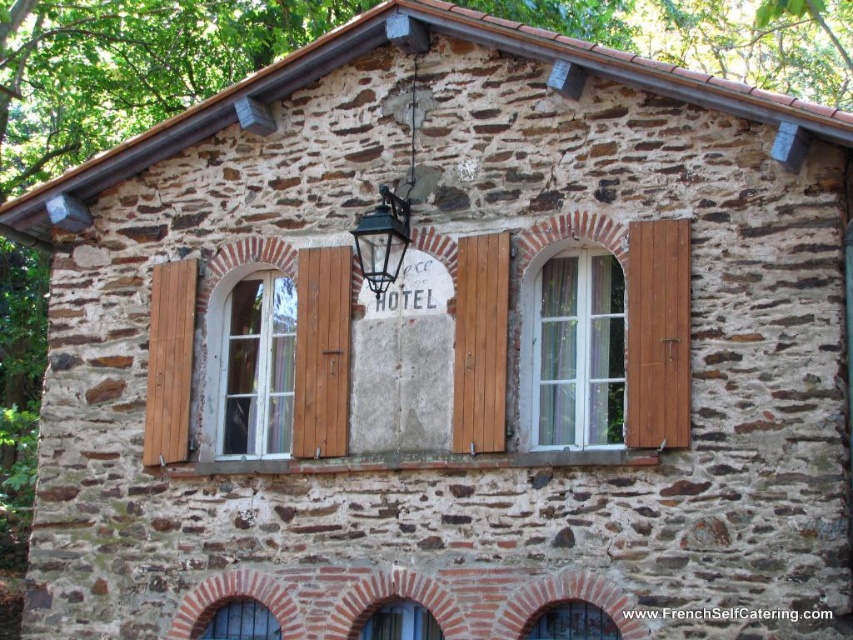
Measure the distance from matte stone arch at lower center to clear glass window at center.

matte stone arch at lower center is 5.50 meters away from clear glass window at center.

Is point (555, 605) farther from viewer compared to point (383, 604)?

No, (555, 605) is closer to viewer.

What do you see at coordinates (570, 621) in the screenshot? I see `matte stone arch at lower center` at bounding box center [570, 621].

At what (x,y) coordinates should I click in order to perform the action: click on matte stone arch at lower center. Please return your answer as a coordinate pair (x, y). Looking at the image, I should click on (570, 621).

Does brown wooden shutter at right appear on the right side of clear glass window at center?

Correct, you'll find brown wooden shutter at right to the right of clear glass window at center.

Who is positioned more to the right, brown wooden shutter at right or clear glass window at center?

brown wooden shutter at right is more to the right.

Is point (674, 316) more distant than point (401, 604)?

No, it is in front of (401, 604).

At what (x,y) coordinates should I click in order to perform the action: click on brown wooden shutter at right. Please return your answer as a coordinate pair (x, y). This screenshot has height=640, width=853. Looking at the image, I should click on (657, 333).

Who is more distant from viewer, (572, 340) or (376, 260)?

The point (376, 260) is more distant.

Find the location of a particular element. white glass window at center is located at coordinates (579, 349).